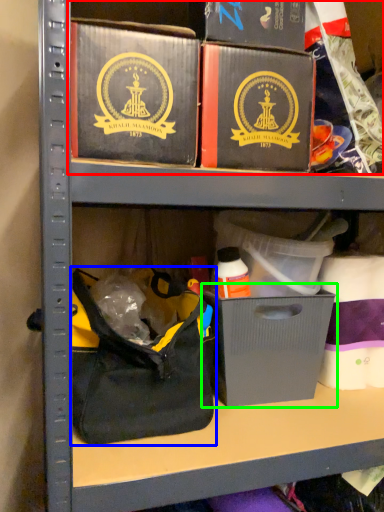
Question: Considering the real-world distances, which object is closest to collection (highlighted by a red box)? handbag (highlighted by a blue box) or cardboard box (highlighted by a green box).

Choices:
 (A) handbag
 (B) cardboard box

Answer: (B)